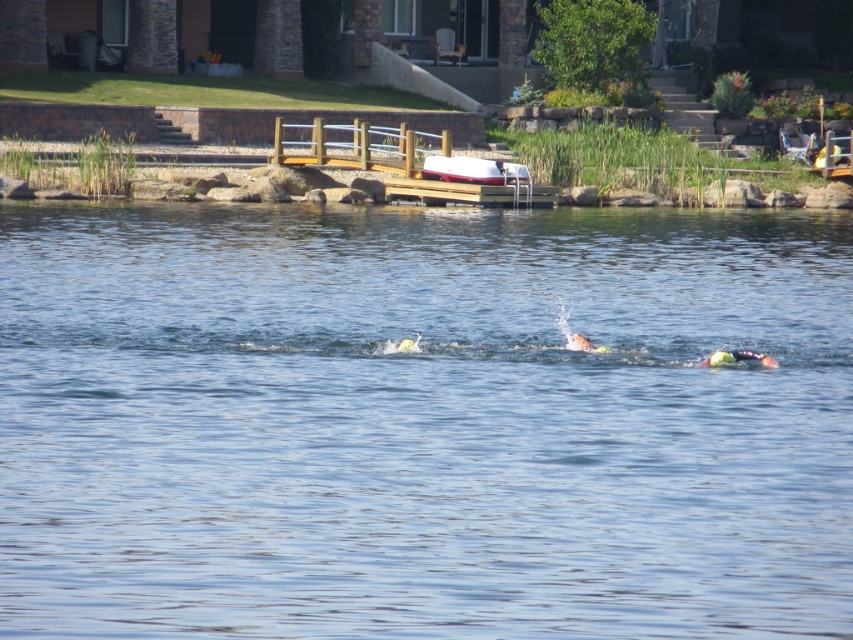
Does clear blue water at center appear over yellow-green swim cap at right?

Yes.

Who is more distant from viewer, (410, 605) or (730, 356)?

Positioned behind is point (730, 356).

This screenshot has width=853, height=640. In order to click on clear blue water at center in this screenshot , I will do `click(422, 422)`.

How much distance is there between white matte boat at center and yellow-green swim cap at right?

The distance of white matte boat at center from yellow-green swim cap at right is 92.89 feet.

Which is in front, point (474, 182) or point (762, 364)?

Point (762, 364) is in front.

Is point (485, 182) positioned behind point (712, 360)?

That is True.

The height and width of the screenshot is (640, 853). Identify the location of white matte boat at center. (473, 170).

Can you confirm if clear blue water at center is positioned below white matte boat at center?

Yes, clear blue water at center is below white matte boat at center.

What do you see at coordinates (422, 422) in the screenshot? I see `clear blue water at center` at bounding box center [422, 422].

The height and width of the screenshot is (640, 853). I want to click on clear blue water at center, so click(x=422, y=422).